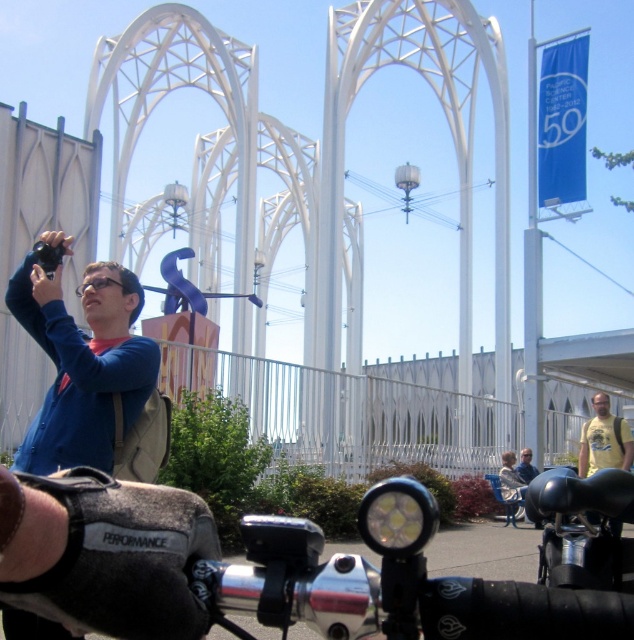
Question: Does shiny chrome handlebars at lower center appear over yellow t-shirt at center?

Choices:
 (A) no
 (B) yes

Answer: (B)

Question: Does shiny chrome handlebars at lower center appear over yellow t-shirt at center?

Choices:
 (A) yes
 (B) no

Answer: (A)

Question: Which of the following is the closest to the observer?

Choices:
 (A) (157, 564)
 (B) (630, 467)

Answer: (A)

Question: Does shiny chrome handlebars at lower center have a lesser width compared to yellow t-shirt at center?

Choices:
 (A) yes
 (B) no

Answer: (B)

Question: Which point is closer to the camera?

Choices:
 (A) (586, 438)
 (B) (204, 564)

Answer: (B)